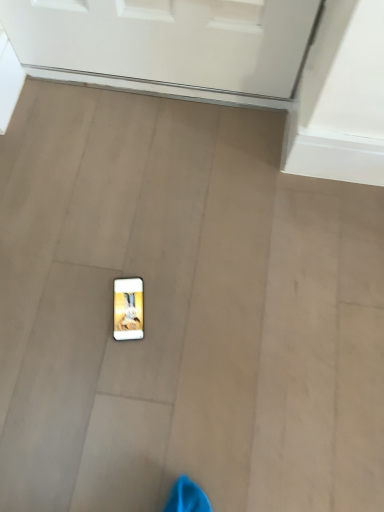
In order to click on free point behind matte white phone at center in this screenshot , I will do `click(131, 246)`.